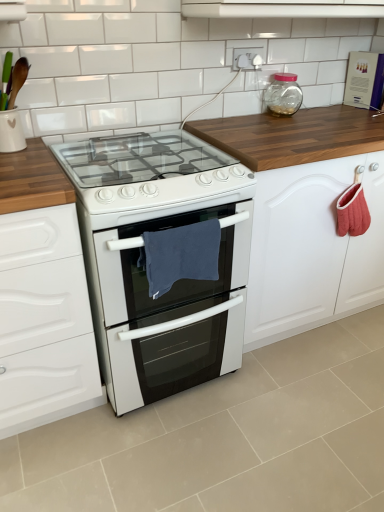
Question: Is blue fabric towel at center looking in the opposite direction of white glossy vent at upper center?

Choices:
 (A) no
 (B) yes

Answer: (A)

Question: From a real-world perspective, is blue fabric towel at center physically below white glossy vent at upper center?

Choices:
 (A) no
 (B) yes

Answer: (B)

Question: From the image's perspective, is blue fabric towel at center beneath white glossy vent at upper center?

Choices:
 (A) no
 (B) yes

Answer: (B)

Question: Is blue fabric towel at center at the right side of white glossy vent at upper center?

Choices:
 (A) yes
 (B) no

Answer: (B)

Question: Is there a large distance between blue fabric towel at center and white glossy vent at upper center?

Choices:
 (A) no
 (B) yes

Answer: (A)

Question: From a real-world perspective, is white glossy vent at upper center physically located above or below blue fabric towel at center?

Choices:
 (A) above
 (B) below

Answer: (A)

Question: In the image, is white glossy vent at upper center positioned in front of or behind blue fabric towel at center?

Choices:
 (A) behind
 (B) front

Answer: (A)

Question: In terms of width, does white glossy vent at upper center look wider or thinner when compared to blue fabric towel at center?

Choices:
 (A) thin
 (B) wide

Answer: (B)

Question: Based on their sizes in the image, would you say white glossy vent at upper center is bigger or smaller than blue fabric towel at center?

Choices:
 (A) big
 (B) small

Answer: (A)

Question: Does point 266,4 appear closer or farther from the camera than point 142,71?

Choices:
 (A) closer
 (B) farther

Answer: (A)

Question: Is white glossy vent at upper center inside or outside of white glossy tile at upper center?

Choices:
 (A) outside
 (B) inside

Answer: (A)

Question: In terms of size, does white glossy vent at upper center appear bigger or smaller than white glossy tile at upper center?

Choices:
 (A) big
 (B) small

Answer: (A)

Question: Considering the positions of white glossy vent at upper center and white glossy tile at upper center in the image, is white glossy vent at upper center wider or thinner than white glossy tile at upper center?

Choices:
 (A) thin
 (B) wide

Answer: (B)

Question: From a real-world perspective, relative to white glossy vent at upper center, is white glossy tile at upper center vertically above or below?

Choices:
 (A) above
 (B) below

Answer: (B)

Question: Considering the positions of white glossy tile at upper center and white glossy vent at upper center in the image, is white glossy tile at upper center taller or shorter than white glossy vent at upper center?

Choices:
 (A) short
 (B) tall

Answer: (B)